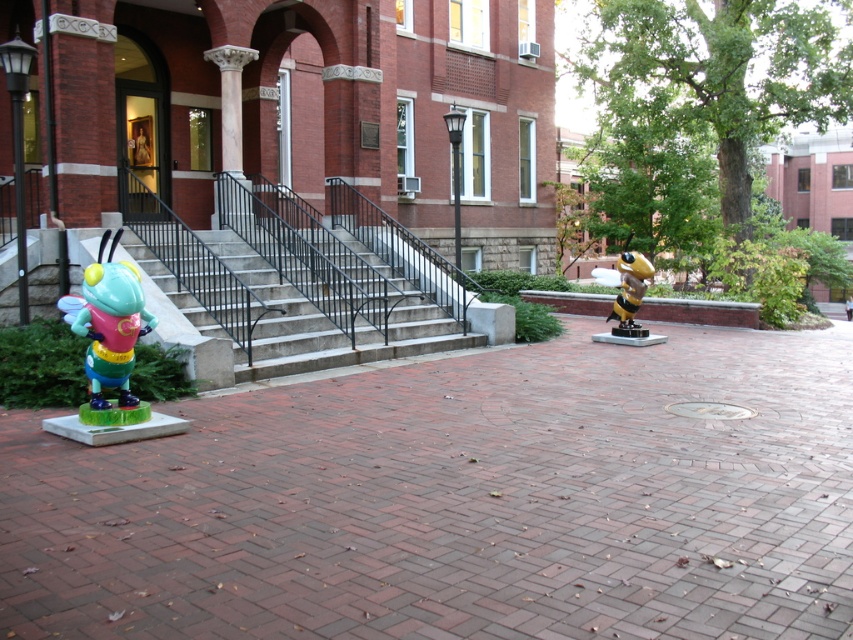
You are standing in the courtyard and want to place a new flower pot. The flower pot is 0.3 meters in diameter. There is a spot at point (108,323). Can the flower pot fit there without overlapping any objects?

The spot at point (108,323) is occupied by a matte plastic bee at left, so the flower pot cannot be placed there.

You are an art student trying to place a new sculpture in the courtyard. The new sculpture is 10 cm wide. You see the matte plastic bee at left and the yellow and black plastic bee at center right. Which existing sculpture can the new sculpture fit next to without overlapping?

The new sculpture can fit next to the matte plastic bee at left because it is thinner than the yellow and black plastic bee at center right, so there is more space available on its side.

You are standing on the concrete stairs at center and want to reach the yellow and black plastic bee at center right. Which direction should you move to get closer to the bee?

Since the concrete stairs at center is below the yellow and black plastic bee at center right, you should move upward to get closer to the bee.